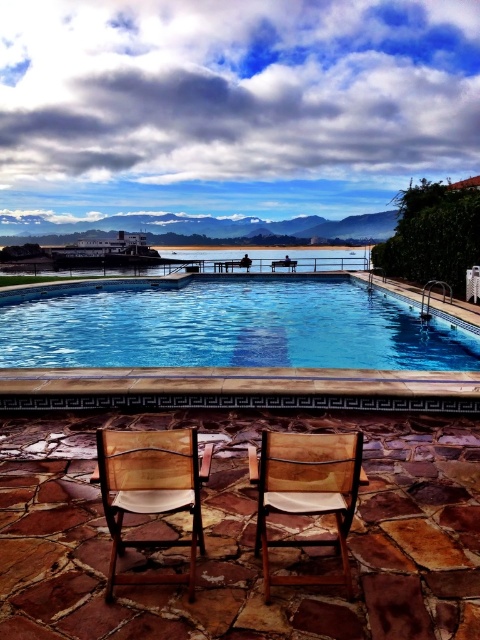
From the picture: You are standing on the wooden chair at lower center and want to jump into the blue glassy swimming pool at center. Is the pool accessible from your current position?

The blue glassy swimming pool at center is located above the wooden chair at lower center, so yes, you can jump into the blue glassy swimming pool at center from the wooden chair at lower center.

You are planning to place a new rectangular table that is 2 meters wide between the blue glassy swimming pool at center and the wooden chair with white cushion at center. Considering their widths, will the table fit between them without overlapping either?

The blue glassy swimming pool at center is wider than the wooden chair with white cushion at center. Since the table is 2 meters wide, it depends on the actual distance between them. However, the question only provides information about their widths, not the space between them. Therefore, we cannot determine if the table will fit based on the given details.